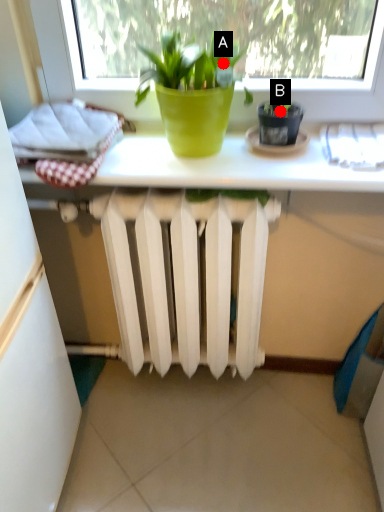
Question: Two points are circled on the image, labeled by A and B beside each circle. Which of the following is the closest to the observer?

Choices:
 (A) A is closer
 (B) B is closer

Answer: (A)